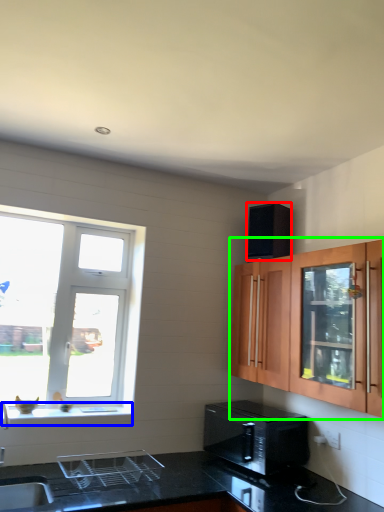
Question: Which object is positioned farthest from appliance (highlighted by a red box)? Select from window sill (highlighted by a blue box) and cabinetry (highlighted by a green box).

Choices:
 (A) window sill
 (B) cabinetry

Answer: (A)